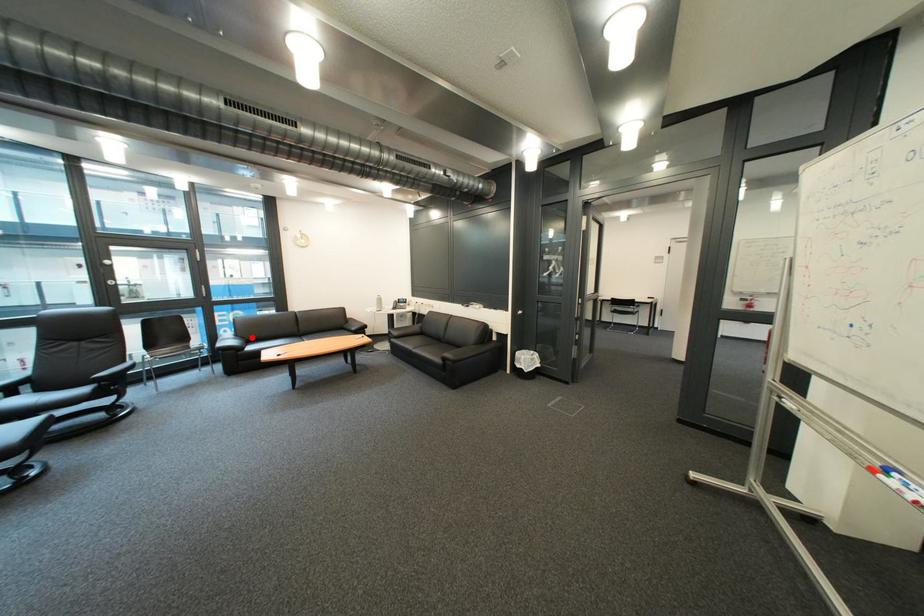
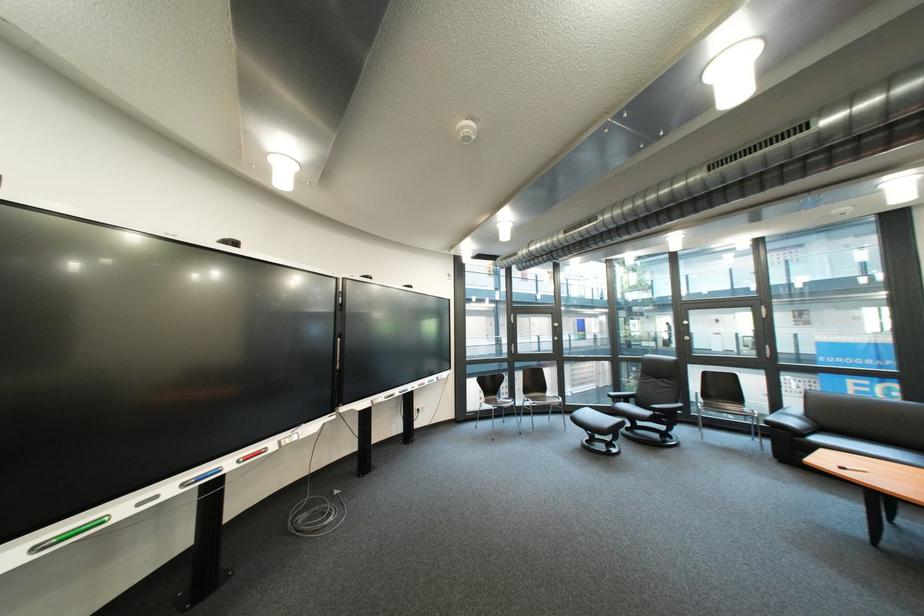
The point at the highlighted location is marked in the first image. Where is the corresponding point in the second image?

(822, 418)